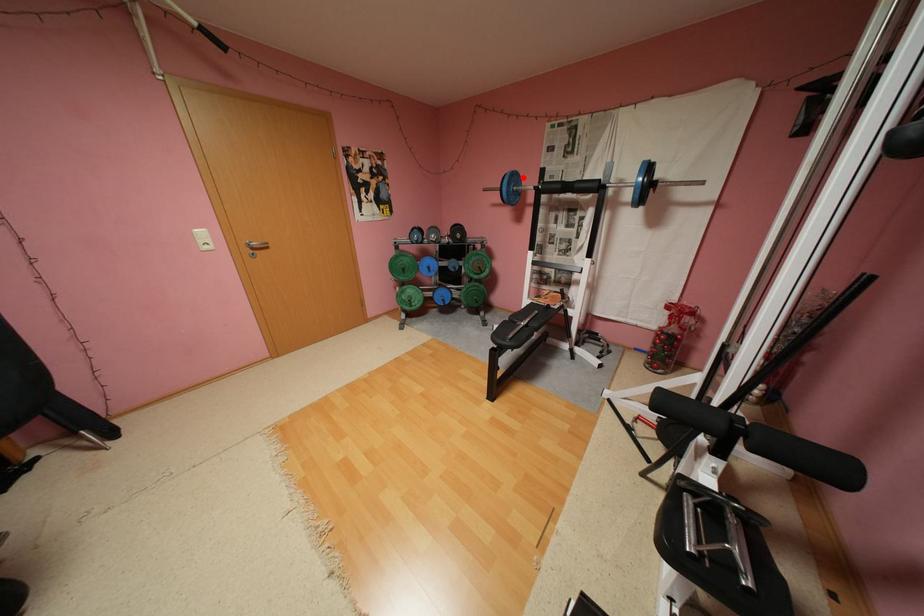
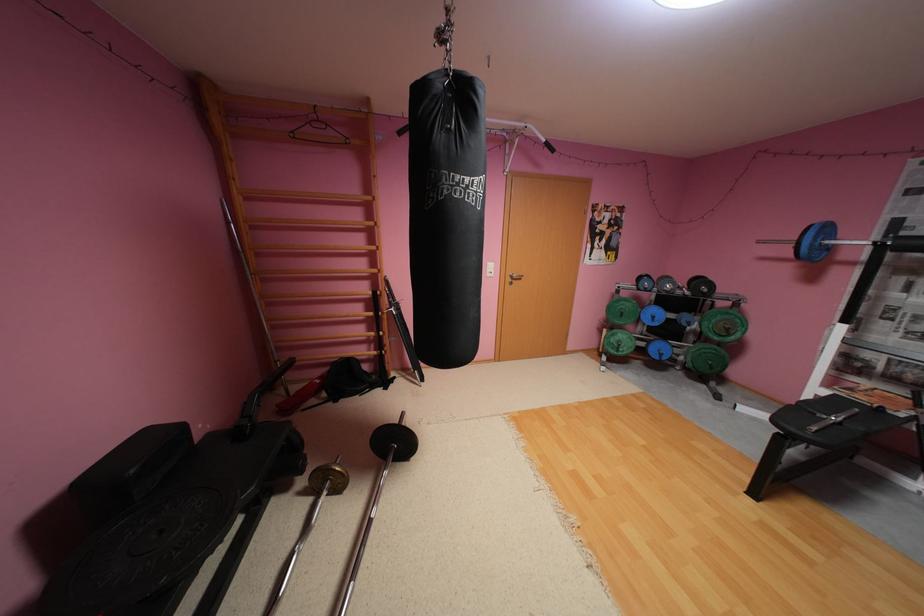
Find the pixel in the second image that matches the highlighted location in the first image.

(835, 229)